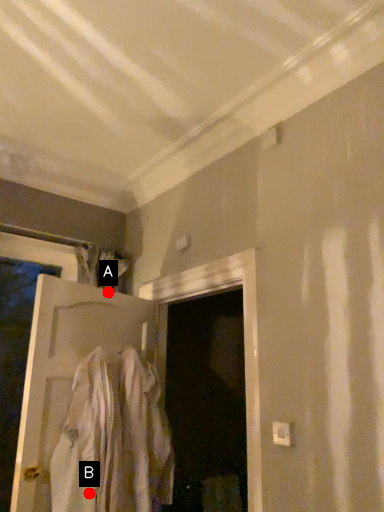
Question: Two points are circled on the image, labeled by A and B beside each circle. Which of the following is the closest to the observer?

Choices:
 (A) A is closer
 (B) B is closer

Answer: (B)